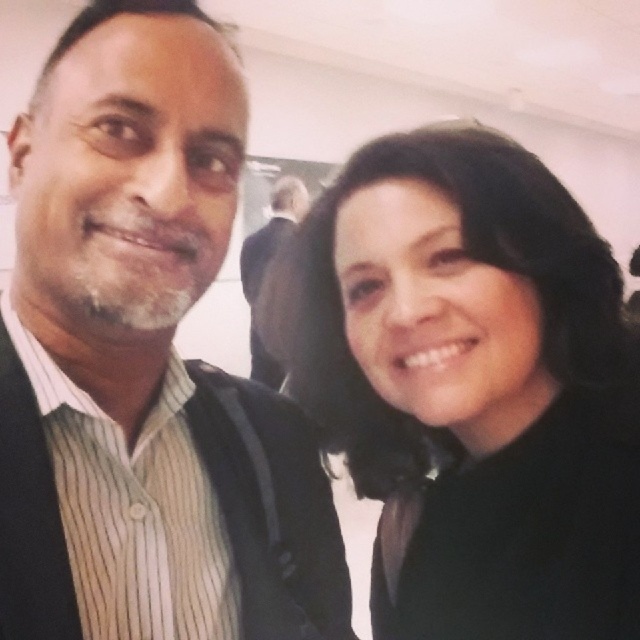
Which is more to the left, black matte hair at center or dark suit at center?

dark suit at center

Does black matte hair at center have a larger size compared to dark suit at center?

Actually, black matte hair at center might be smaller than dark suit at center.

Who is more distant from viewer, (x=454, y=410) or (x=276, y=384)?

Positioned behind is point (x=276, y=384).

The width and height of the screenshot is (640, 640). What are the coordinates of `black matte hair at center` in the screenshot? It's located at (470, 385).

Between striped cotton shirt at left and black matte hair at center, which one is positioned higher?

black matte hair at center is higher up.

Locate an element on the screen. The height and width of the screenshot is (640, 640). striped cotton shirt at left is located at coordinates (145, 362).

At what (x,y) coordinates should I click in order to perform the action: click on striped cotton shirt at left. Please return your answer as a coordinate pair (x, y). This screenshot has width=640, height=640. Looking at the image, I should click on (145, 362).

Consider the image. Measure the distance between point (x=317, y=580) and camera.

A distance of 27.22 inches exists between point (x=317, y=580) and camera.

Can you confirm if striped cotton shirt at left is positioned above dark suit at center?

No, striped cotton shirt at left is not above dark suit at center.

Is point (221, 637) positioned behind point (273, 250)?

No, (221, 637) is in front of (273, 250).

At what (x,y) coordinates should I click in order to perform the action: click on striped cotton shirt at left. Please return your answer as a coordinate pair (x, y). This screenshot has width=640, height=640. Looking at the image, I should click on (145, 362).